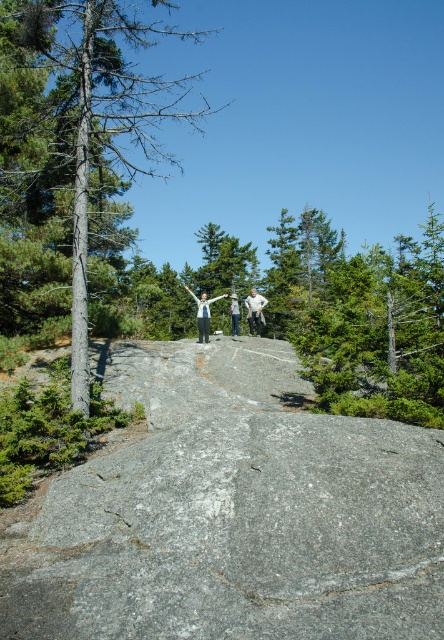
Can you confirm if gray rough rock at center is positioned above white fabric pants at center?

Actually, gray rough rock at center is below white fabric pants at center.

Who is higher up, gray rough rock at center or white fabric pants at center?

white fabric pants at center

This screenshot has height=640, width=444. What do you see at coordinates (233, 513) in the screenshot? I see `gray rough rock at center` at bounding box center [233, 513].

The image size is (444, 640). Identify the location of gray rough rock at center. (233, 513).

Is point (252, 305) closer to camera compared to point (237, 330)?

Yes.

Between white cotton shirt at center and white fabric pants at center, which one appears on the left side from the viewer's perspective?

white fabric pants at center is more to the left.

Locate an element on the screen. This screenshot has height=640, width=444. white cotton shirt at center is located at coordinates (254, 308).

The image size is (444, 640). Find the location of `white cotton shirt at center`. white cotton shirt at center is located at coordinates (254, 308).

Is gray rough rock at center to the left of green textured tree at center from the viewer's perspective?

In fact, gray rough rock at center is to the right of green textured tree at center.

Which is above, gray rough rock at center or green textured tree at center?

green textured tree at center is higher up.

What do you see at coordinates (233, 513) in the screenshot? I see `gray rough rock at center` at bounding box center [233, 513].

You are a GUI agent. You are given a task and a screenshot of the screen. Output one action in this format:
    pyautogui.click(x=<x>, y=<y>)
    Task: Click on the gray rough rock at center
    This screenshot has height=640, width=444.
    Given the screenshot: What is the action you would take?
    pyautogui.click(x=233, y=513)